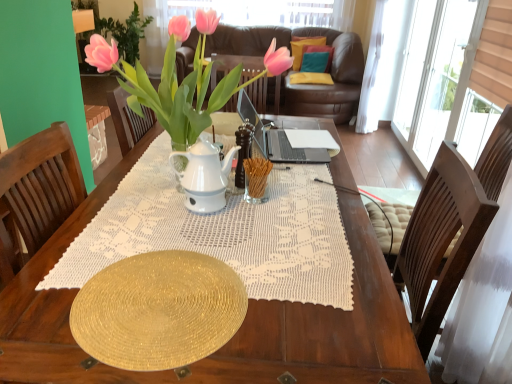
Question: In the image, is yellow fabric pillow at center, marked as the first pillow in a bottom-to-top arrangement, on the left side or the right side of teal fabric pillow at upper center, arranged as the 2th pillow when viewed from the top?

Choices:
 (A) left
 (B) right

Answer: (B)

Question: Based on their sizes in the image, would you say yellow fabric pillow at center, positioned as the third pillow in top-to-bottom order, is bigger or smaller than teal fabric pillow at upper center, the 2th pillow from the bottom?

Choices:
 (A) big
 (B) small

Answer: (B)

Question: Which is nearer to the velvet yellow pillow at upper center, which ranks as the 1th pillow in top-to-bottom order?

Choices:
 (A) yellow fabric pillow at center, marked as the first pillow in a bottom-to-top arrangement
 (B) gold textured plate at center
 (C) pink glossy houseplant at upper center
 (D) teal fabric pillow at upper center, arranged as the 2th pillow when viewed from the top

Answer: (D)

Question: Estimate the real-world distances between objects in this image. Which object is farther from the yellow fabric pillow at center, marked as the first pillow in a bottom-to-top arrangement?

Choices:
 (A) teal fabric pillow at upper center, the 2th pillow from the bottom
 (B) gold textured plate at center
 (C) pink glossy houseplant at upper center
 (D) velvet yellow pillow at upper center, acting as the 3th pillow starting from the bottom

Answer: (B)